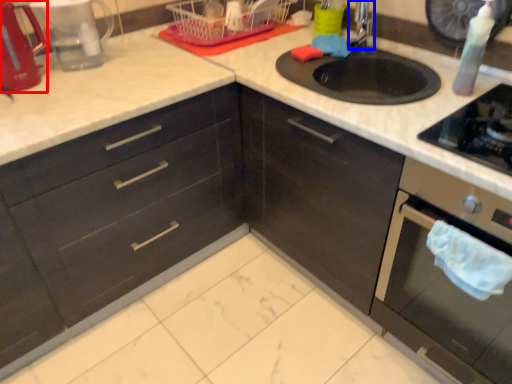
Question: Which of the following is the farthest to the observer, appliance (highlighted by a red box) or faucet (highlighted by a blue box)?

Choices:
 (A) appliance
 (B) faucet

Answer: (B)